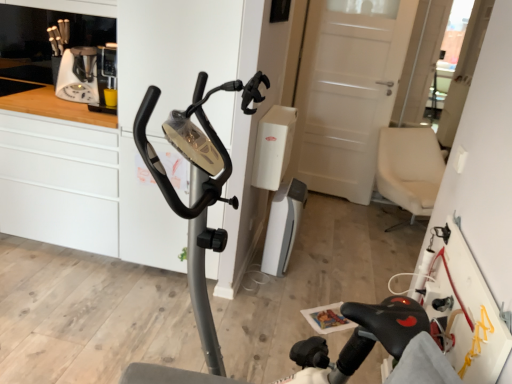
The image size is (512, 384). Find the location of `vacant area that is in front of white glossy dresser at center`. vacant area that is in front of white glossy dresser at center is located at coordinates (158, 307).